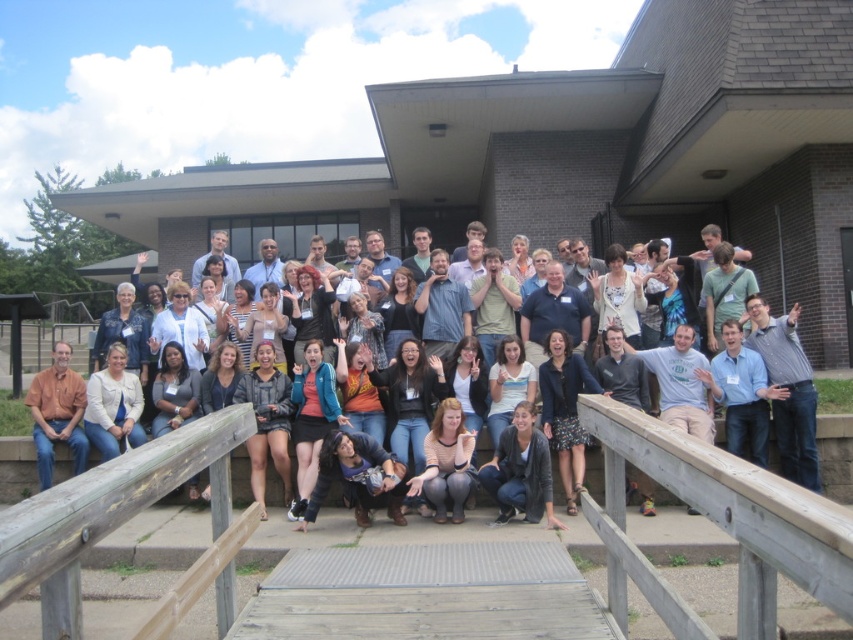
Question: Can you confirm if brown wooden rail at lower center is wider than orange shirt at left?

Choices:
 (A) no
 (B) yes

Answer: (B)

Question: Does brown wooden rail at lower center have a greater width compared to matte black jacket at center?

Choices:
 (A) no
 (B) yes

Answer: (B)

Question: Which of these objects is positioned closest to the matte black jacket at center?

Choices:
 (A) orange shirt at left
 (B) brown wooden rail at lower center

Answer: (B)

Question: Among these points, which one is nearest to the camera?

Choices:
 (A) [68, 392]
 (B) [463, 525]

Answer: (B)

Question: Does matte black jacket at center have a greater width compared to orange shirt at left?

Choices:
 (A) yes
 (B) no

Answer: (A)

Question: Which object is closer to the camera taking this photo?

Choices:
 (A) orange shirt at left
 (B) brown wooden rail at lower center

Answer: (B)